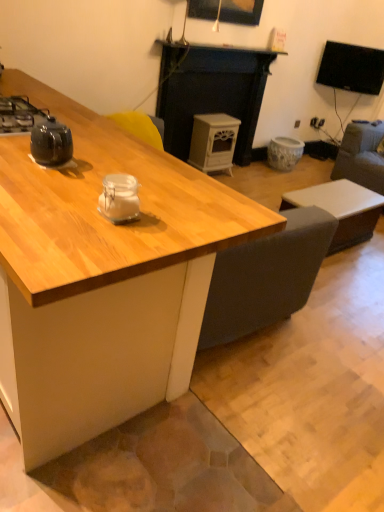
Question: Can you confirm if black glossy tv at upper right is positioned to the left of wooden picture frame at upper center?

Choices:
 (A) no
 (B) yes

Answer: (A)

Question: Would you consider black glossy tv at upper right to be distant from wooden picture frame at upper center?

Choices:
 (A) yes
 (B) no

Answer: (A)

Question: Are black glossy tv at upper right and wooden picture frame at upper center beside each other?

Choices:
 (A) no
 (B) yes

Answer: (A)

Question: Does black glossy tv at upper right have a lesser width compared to wooden picture frame at upper center?

Choices:
 (A) yes
 (B) no

Answer: (B)

Question: Is wooden picture frame at upper center at the back of black glossy tv at upper right?

Choices:
 (A) yes
 (B) no

Answer: (B)

Question: From a real-world perspective, is black glossy tv at upper right physically below wooden picture frame at upper center?

Choices:
 (A) no
 (B) yes

Answer: (B)

Question: Does white matte coffee table at lower right appear on the left side of wooden desk at center?

Choices:
 (A) no
 (B) yes

Answer: (A)

Question: From a real-world perspective, is white matte coffee table at lower right beneath wooden desk at center?

Choices:
 (A) no
 (B) yes

Answer: (B)

Question: From a real-world perspective, does white matte coffee table at lower right stand above wooden desk at center?

Choices:
 (A) no
 (B) yes

Answer: (A)

Question: From the image's perspective, is white matte coffee table at lower right below wooden desk at center?

Choices:
 (A) yes
 (B) no

Answer: (B)

Question: Would you consider white matte coffee table at lower right to be distant from wooden desk at center?

Choices:
 (A) no
 (B) yes

Answer: (B)

Question: Could you tell me if white matte coffee table at lower right is turned towards wooden desk at center?

Choices:
 (A) yes
 (B) no

Answer: (B)

Question: Can you confirm if white matte coffee table at lower right is smaller than black glossy kettle at left?

Choices:
 (A) no
 (B) yes

Answer: (A)